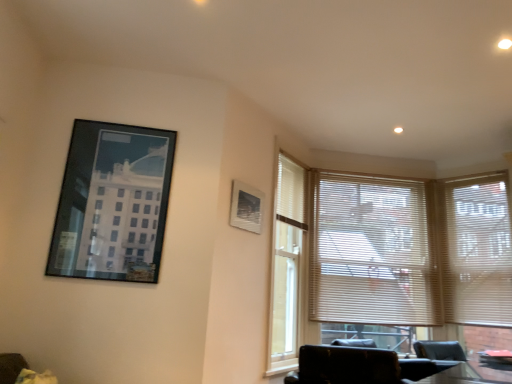
In order to click on blank space above white blinds at right, the 1th window blind positioned from the right (from a real-world perspective) in this screenshot , I will do `click(472, 178)`.